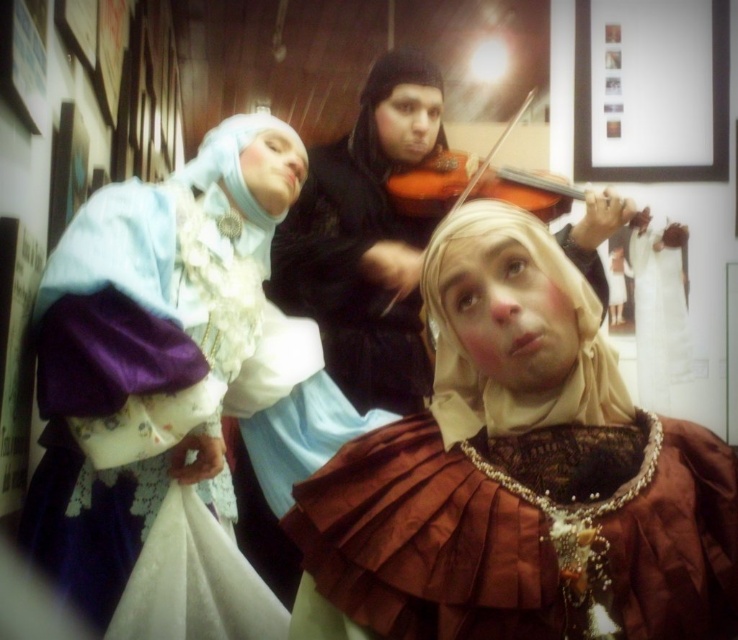
Does matte blue fabric dress at left have a lesser height compared to silky white gown at center?

No.

Is matte blue fabric dress at left thinner than silky white gown at center?

Incorrect, matte blue fabric dress at left's width is not less than silky white gown at center's.

Is point (193, 582) farther from viewer compared to point (666, 371)?

No, it is not.

Where is `matte blue fabric dress at left`? Image resolution: width=738 pixels, height=640 pixels. matte blue fabric dress at left is located at coordinates (162, 388).

Can you confirm if brown satin dress at center is positioned above wooden violin at center?

No, brown satin dress at center is not above wooden violin at center.

Is brown satin dress at center taller than wooden violin at center?

Yes.

Identify the location of brown satin dress at center. (517, 476).

The width and height of the screenshot is (738, 640). Identify the location of silky white gown at center. (658, 308).

Between silky white gown at center and wooden violin at center, which one has less height?

Standing shorter between the two is wooden violin at center.

Where is `silky white gown at center`? Image resolution: width=738 pixels, height=640 pixels. silky white gown at center is located at coordinates (658, 308).